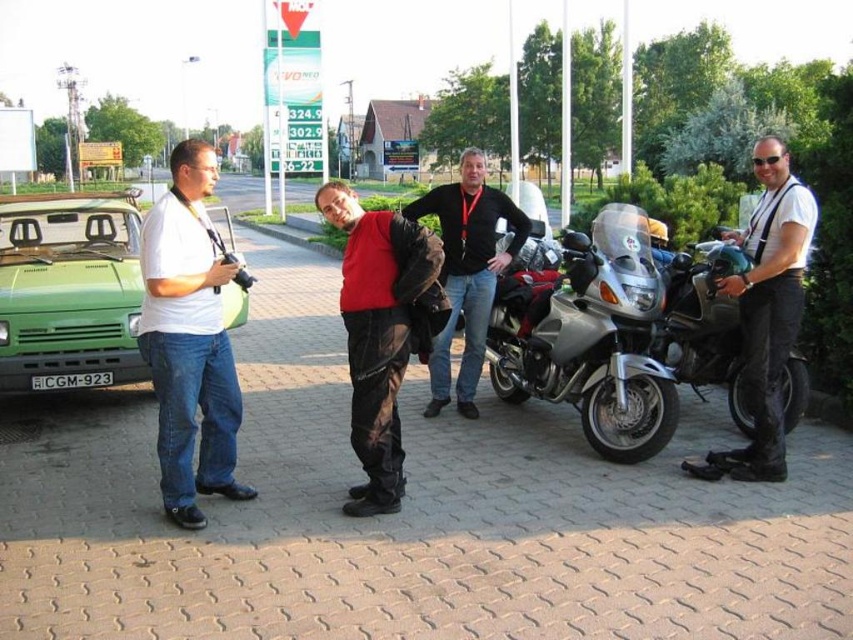
You are a photographer trying to capture a photo of the scene. You want to ensure that both the point at (28, 257) and the point at (370, 273) are in focus. Which point should you focus on first to ensure the other is also in focus?

You should focus on the point at (370, 273) first because it is farther from the camera than the point at (28, 257). By focusing on the farther point, the closer point will also be within the depth of field, ensuring both are in focus.

You are a delivery person who needs to place a small package between the red matte jacket at center and the black plastic license plate at center. The package requires a minimum of 2 meters of space. Can you fit it there?

The distance between the red matte jacket at center and the black plastic license plate at center is 3.09 meters, which is more than the required 2 meters. Yes, the package can be placed there.

You are a photographer trying to capture a photo of the red matte jacket at center and the black plastic license plate at center. Which object should you focus on first if you want to ensure both are in sharp focus?

The red matte jacket at center is above the black plastic license plate at center. Since they are at different heights, you should focus on the red matte jacket at center first to ensure depth of field captures both.